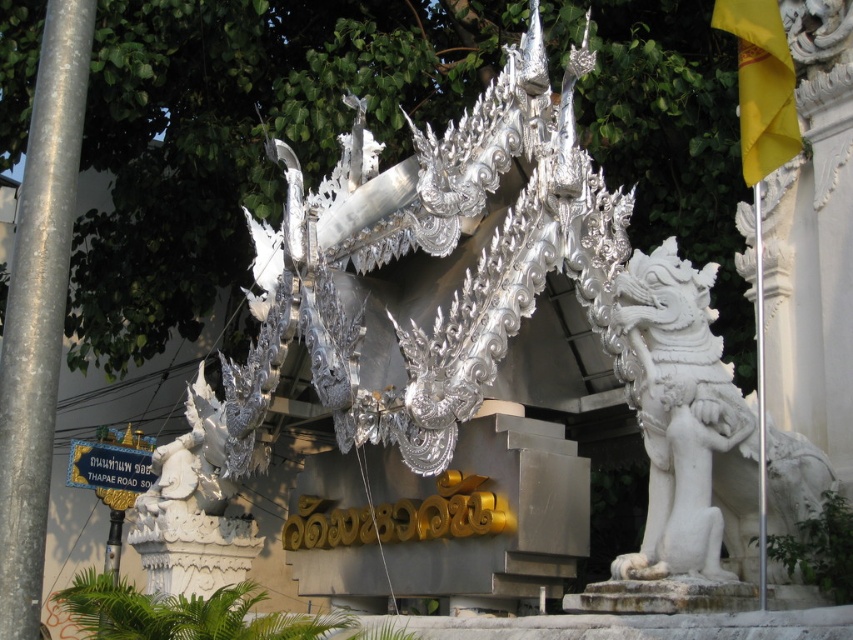
Question: Which object is farther from the camera taking this photo?

Choices:
 (A) silver metallic pole at left
 (B) gold metallic street sign at lower left

Answer: (B)

Question: Among these points, which one is nearest to the camera?

Choices:
 (A) (140, 467)
 (B) (44, 292)

Answer: (B)

Question: Does silver metallic pole at left appear on the right side of gold metallic street sign at lower left?

Choices:
 (A) no
 (B) yes

Answer: (B)

Question: Which point appears closest to the camera in this image?

Choices:
 (A) tap(105, 445)
 (B) tap(19, 620)

Answer: (B)

Question: Can you confirm if silver metallic pole at left is thinner than gold metallic street sign at lower left?

Choices:
 (A) no
 (B) yes

Answer: (B)

Question: Observing the image, what is the correct spatial positioning of silver metallic pole at left in reference to gold metallic street sign at lower left?

Choices:
 (A) above
 (B) below

Answer: (A)